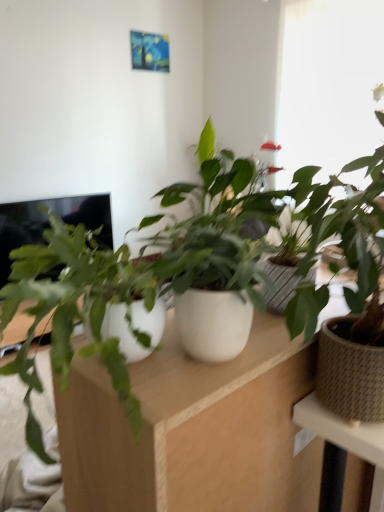
Measure the distance between white matte pot at center, which ranks as the 1th houseplant in left-to-right order, and camera.

The depth of white matte pot at center, which ranks as the 1th houseplant in left-to-right order, is 22.89 inches.

Locate an element on the screen. This screenshot has height=512, width=384. black glossy screen at left is located at coordinates (48, 223).

Where is `white matte computer desk at center`? This screenshot has height=512, width=384. white matte computer desk at center is located at coordinates (192, 430).

The height and width of the screenshot is (512, 384). Describe the element at coordinates (328, 85) in the screenshot. I see `transparent glass window at upper right` at that location.

Find the location of a particular element. Image resolution: width=384 pixels, height=512 pixels. white matte pot at center, which ranks as the 1th houseplant in left-to-right order is located at coordinates (214, 253).

Is white matte pot at center, positioned as the 2th houseplant in right-to-left order, at the back of transparent glass window at upper right?

No.

Considering the relative sizes of transparent glass window at upper right and white matte pot at center, positioned as the 2th houseplant in right-to-left order, in the image provided, is transparent glass window at upper right shorter than white matte pot at center, positioned as the 2th houseplant in right-to-left order,?

No.

Is there a large distance between transparent glass window at upper right and white matte pot at center, which ranks as the 1th houseplant in left-to-right order?

transparent glass window at upper right is positioned a significant distance from white matte pot at center, which ranks as the 1th houseplant in left-to-right order.

From the image's perspective, is transparent glass window at upper right located above white matte pot at center, which ranks as the 1th houseplant in left-to-right order?

Yes, from the image's perspective, transparent glass window at upper right is on top of white matte pot at center, which ranks as the 1th houseplant in left-to-right order.

Could you tell me if white matte pot at center, which ranks as the 1th houseplant in left-to-right order, is facing brown woven pot at right, the 1th houseplant viewed from the right?

No, white matte pot at center, which ranks as the 1th houseplant in left-to-right order, is not facing towards brown woven pot at right, the 1th houseplant viewed from the right.

Can you confirm if white matte pot at center, which ranks as the 1th houseplant in left-to-right order, is shorter than brown woven pot at right, the 1th houseplant viewed from the right?

Yes, white matte pot at center, which ranks as the 1th houseplant in left-to-right order, is shorter than brown woven pot at right, the 1th houseplant viewed from the right.

Looking at this image, does white matte pot at center, positioned as the 2th houseplant in right-to-left order, have a larger size compared to brown woven pot at right, the 2th houseplant in the left-to-right sequence?

No.

From the image's perspective, would you say white matte pot at center, positioned as the 2th houseplant in right-to-left order, is shown under brown woven pot at right, the 2th houseplant in the left-to-right sequence?

Incorrect, from the image's perspective, white matte pot at center, positioned as the 2th houseplant in right-to-left order, is higher than brown woven pot at right, the 2th houseplant in the left-to-right sequence.

Which object is closer to the camera, white matte computer desk at center or brown woven pot at right, the 1th houseplant viewed from the right?

white matte computer desk at center is in front.

In the scene shown: Does white matte computer desk at center turn towards brown woven pot at right, the 1th houseplant viewed from the right?

No, white matte computer desk at center is not oriented towards brown woven pot at right, the 1th houseplant viewed from the right.

Are white matte computer desk at center and brown woven pot at right, the 2th houseplant in the left-to-right sequence, making contact?

No, white matte computer desk at center is not in contact with brown woven pot at right, the 2th houseplant in the left-to-right sequence.

From a real-world perspective, is white matte computer desk at center on brown woven pot at right, the 1th houseplant viewed from the right?

Incorrect, from a real-world perspective, white matte computer desk at center is lower than brown woven pot at right, the 1th houseplant viewed from the right.

Based on their sizes in the image, would you say black glossy screen at left is bigger or smaller than white matte computer desk at center?

black glossy screen at left is bigger than white matte computer desk at center.

Does black glossy screen at left have a lesser width compared to white matte computer desk at center?

Correct, the width of black glossy screen at left is less than that of white matte computer desk at center.

At what (x,y) coordinates should I click in order to perform the action: click on computer desk on the right of black glossy screen at left. Please return your answer as a coordinate pair (x, y). Looking at the image, I should click on (192, 430).

From the image's perspective, which is below, black glossy screen at left or white matte pot at center, positioned as the 2th houseplant in right-to-left order?

From the image's view, white matte pot at center, positioned as the 2th houseplant in right-to-left order, is below.

Which of these two, black glossy screen at left or white matte pot at center, which ranks as the 1th houseplant in left-to-right order, is smaller?

With smaller size is white matte pot at center, which ranks as the 1th houseplant in left-to-right order.

Is black glossy screen at left to the left of white matte pot at center, which ranks as the 1th houseplant in left-to-right order, from the viewer's perspective?

Correct, you'll find black glossy screen at left to the left of white matte pot at center, which ranks as the 1th houseplant in left-to-right order.

Can we say black glossy screen at left lies outside white matte pot at center, which ranks as the 1th houseplant in left-to-right order?

Absolutely, black glossy screen at left is external to white matte pot at center, which ranks as the 1th houseplant in left-to-right order.

Between black glossy screen at left and brown woven pot at right, the 2th houseplant in the left-to-right sequence, which one has larger width?

black glossy screen at left is wider.

Is brown woven pot at right, the 1th houseplant viewed from the right, completely or partially inside black glossy screen at left?

No, brown woven pot at right, the 1th houseplant viewed from the right, is not a part of black glossy screen at left.

Is black glossy screen at left facing towards brown woven pot at right, the 2th houseplant in the left-to-right sequence?

Yes, black glossy screen at left faces towards brown woven pot at right, the 2th houseplant in the left-to-right sequence.

From the image's perspective, is black glossy screen at left over brown woven pot at right, the 1th houseplant viewed from the right?

Yes, from the image's perspective, black glossy screen at left is on top of brown woven pot at right, the 1th houseplant viewed from the right.

Considering the positions of objects white matte computer desk at center and transparent glass window at upper right in the image provided, who is in front, white matte computer desk at center or transparent glass window at upper right?

white matte computer desk at center is more forward.

Would you say white matte computer desk at center is outside transparent glass window at upper right?

Indeed, white matte computer desk at center is completely outside transparent glass window at upper right.

In the scene shown: Does white matte computer desk at center turn towards transparent glass window at upper right?

No.

Considering the sizes of objects white matte computer desk at center and transparent glass window at upper right in the image provided, who is smaller, white matte computer desk at center or transparent glass window at upper right?

white matte computer desk at center.

Find the location of a particular element. the 1st houseplant positioned below the transparent glass window at upper right (from the image's perspective) is located at coordinates (214, 253).

What are the coordinates of `houseplant below the white matte pot at center, positioned as the 2th houseplant in right-to-left order (from a real-world perspective)` in the screenshot? It's located at (353, 296).

Based on their spatial positions, is black glossy screen at left or transparent glass window at upper right further from white matte computer desk at center?

Based on the image, transparent glass window at upper right appears to be further to white matte computer desk at center.

Considering their positions, is white matte pot at center, which ranks as the 1th houseplant in left-to-right order, positioned closer to transparent glass window at upper right than brown woven pot at right, the 2th houseplant in the left-to-right sequence?

white matte pot at center, which ranks as the 1th houseplant in left-to-right order, is closer to transparent glass window at upper right.

Based on their spatial positions, is white matte computer desk at center or transparent glass window at upper right closer to white matte pot at center, positioned as the 2th houseplant in right-to-left order?

white matte computer desk at center is positioned closer to the anchor white matte pot at center, positioned as the 2th houseplant in right-to-left order.

Looking at this image, when comparing their distances from brown woven pot at right, the 1th houseplant viewed from the right, does white matte computer desk at center or black glossy screen at left seem further?

Based on the image, black glossy screen at left appears to be further to brown woven pot at right, the 1th houseplant viewed from the right.

Looking at the image, which one is located further to white matte computer desk at center, brown woven pot at right, the 1th houseplant viewed from the right, or transparent glass window at upper right?

Based on the image, transparent glass window at upper right appears to be further to white matte computer desk at center.

Based on their spatial positions, is transparent glass window at upper right or black glossy screen at left closer to brown woven pot at right, the 1th houseplant viewed from the right?

black glossy screen at left is closer to brown woven pot at right, the 1th houseplant viewed from the right.

Based on their spatial positions, is black glossy screen at left or transparent glass window at upper right further from brown woven pot at right, the 1th houseplant viewed from the right?

transparent glass window at upper right is further to brown woven pot at right, the 1th houseplant viewed from the right.

Which object lies further to the anchor point transparent glass window at upper right, white matte pot at center, positioned as the 2th houseplant in right-to-left order, or black glossy screen at left?

white matte pot at center, positioned as the 2th houseplant in right-to-left order.

Where is `computer screen located between white matte pot at center, positioned as the 2th houseplant in right-to-left order, and transparent glass window at upper right in the depth direction`? computer screen located between white matte pot at center, positioned as the 2th houseplant in right-to-left order, and transparent glass window at upper right in the depth direction is located at coordinates (48, 223).

This screenshot has height=512, width=384. Identify the location of houseplant between white matte computer desk at center and brown woven pot at right, the 2th houseplant in the left-to-right sequence. (214, 253).

The image size is (384, 512). I want to click on houseplant positioned between brown woven pot at right, the 1th houseplant viewed from the right, and black glossy screen at left from near to far, so click(214, 253).

This screenshot has height=512, width=384. I want to click on computer screen between white matte computer desk at center and transparent glass window at upper right from front to back, so 48,223.